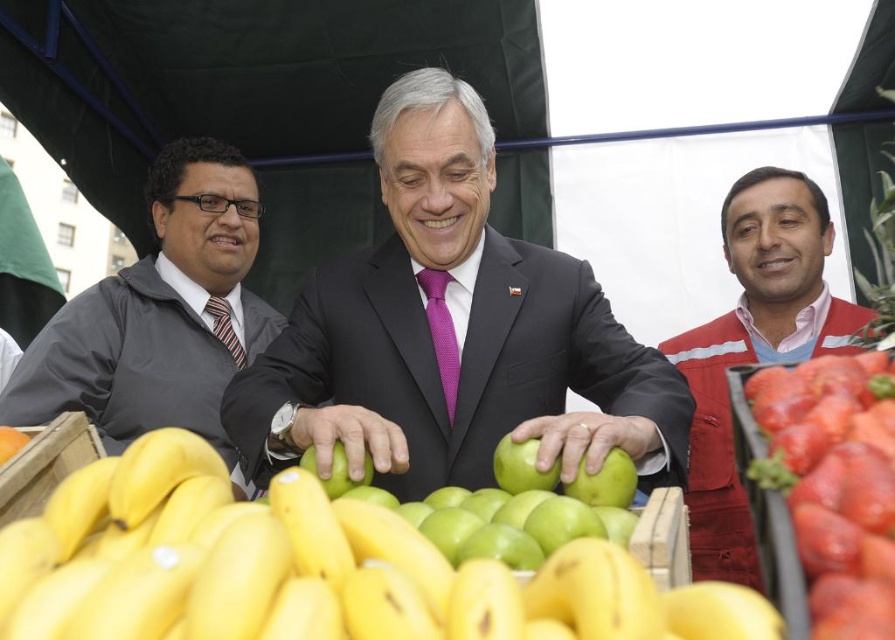
You are a photographer setting up a tripod in the market. You need to position it so that it doesn not block the view of the matte black suit at center and the red fabric vest at right. Given their sizes, which object requires more space to accommodate in the frame?

The red fabric vest at right requires more space because it occupies more area than the matte black suit at center.

You are a customer at the market stall and want to buy the red glossy strawberries at lower right. However, you notice the red fabric vest at right is blocking your view of them. Can you estimate if the strawberries are bigger than the vest?

The red fabric vest at right is larger in size than red glossy strawberries at lower right, so the strawberries are smaller than the vest.